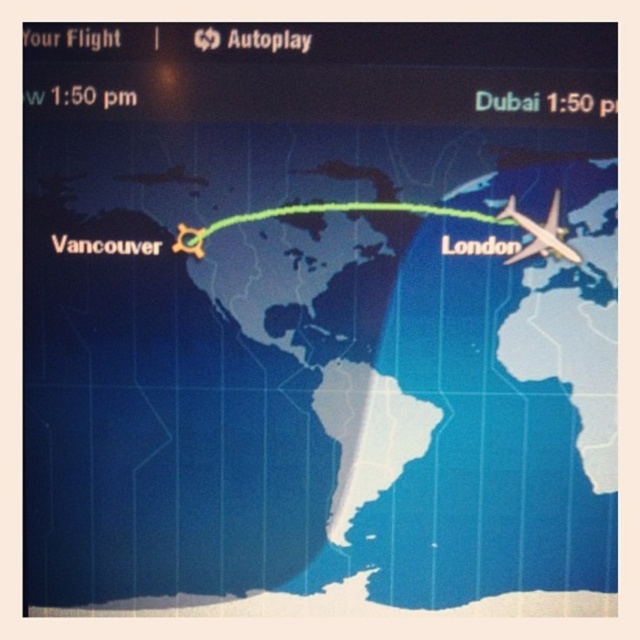
Who is taller, green line at center or metallic silver airplane at right?

metallic silver airplane at right is taller.

In the scene shown: Between green line at center and metallic silver airplane at right, which one has less height?

green line at center is shorter.

At what (x,y) coordinates should I click in order to perform the action: click on green line at center. Please return your answer as a coordinate pair (x, y). The width and height of the screenshot is (640, 640). Looking at the image, I should click on (320, 212).

Locate an element on the screen. This screenshot has height=640, width=640. green line at center is located at coordinates (320, 212).

Can you confirm if matte plastic map at center is smaller than metallic silver airplane at right?

No, matte plastic map at center is not smaller than metallic silver airplane at right.

Find the location of a particular element. Image resolution: width=640 pixels, height=640 pixels. matte plastic map at center is located at coordinates (308, 368).

Which is below, matte plastic map at center or green line at center?

matte plastic map at center

Is point (488, 280) closer to viewer compared to point (173, 246)?

Yes, point (488, 280) is in front of point (173, 246).

Locate an element on the screen. This screenshot has height=640, width=640. matte plastic map at center is located at coordinates (308, 368).